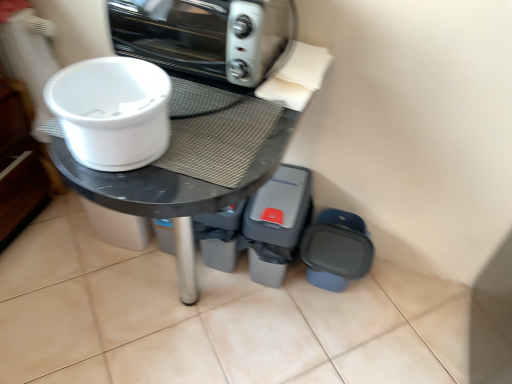
This screenshot has height=384, width=512. I want to click on empty space that is ontop of matte black table at center (from a real-world perspective), so click(x=202, y=116).